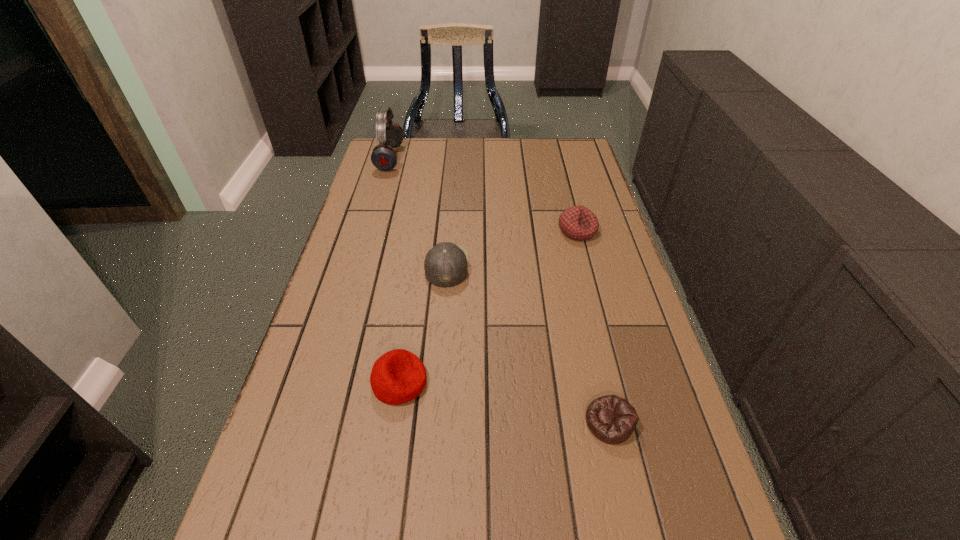
At what (x,y) coordinates should I click in order to perform the action: click on free space that is in between the third farthest object and the earphone. Please return your answer as a coordinate pair (x, y). This screenshot has height=540, width=960. Looking at the image, I should click on (419, 212).

This screenshot has width=960, height=540. What are the coordinates of `vacant area between the tallest object and the cap` in the screenshot? It's located at (419, 212).

Identify the location of empty space between the shortest object and the third nearest object. (528, 344).

Where is `unoccupied position between the shortest beanbag and the leftmost beanbag`? The height and width of the screenshot is (540, 960). unoccupied position between the shortest beanbag and the leftmost beanbag is located at coordinates (504, 402).

Identify the location of unoccupied area between the leftmost beanbag and the farthest beanbag. pos(489,306).

Where is `unoccupied position between the fourth nearest object and the farthest object`? This screenshot has width=960, height=540. unoccupied position between the fourth nearest object and the farthest object is located at coordinates (484, 194).

At what (x,y) coordinates should I click in order to perform the action: click on vacant space in between the shortest beanbag and the leftmost beanbag. Please return your answer as a coordinate pair (x, y). The width and height of the screenshot is (960, 540). Looking at the image, I should click on (504, 402).

Find the location of `vacant point located between the tallest object and the leftmost beanbag`. vacant point located between the tallest object and the leftmost beanbag is located at coordinates (395, 270).

The height and width of the screenshot is (540, 960). Identify the location of the closest object to the second farthest object. (446, 264).

Image resolution: width=960 pixels, height=540 pixels. Find the location of `the second closest object to the farthest object`. the second closest object to the farthest object is located at coordinates [579, 223].